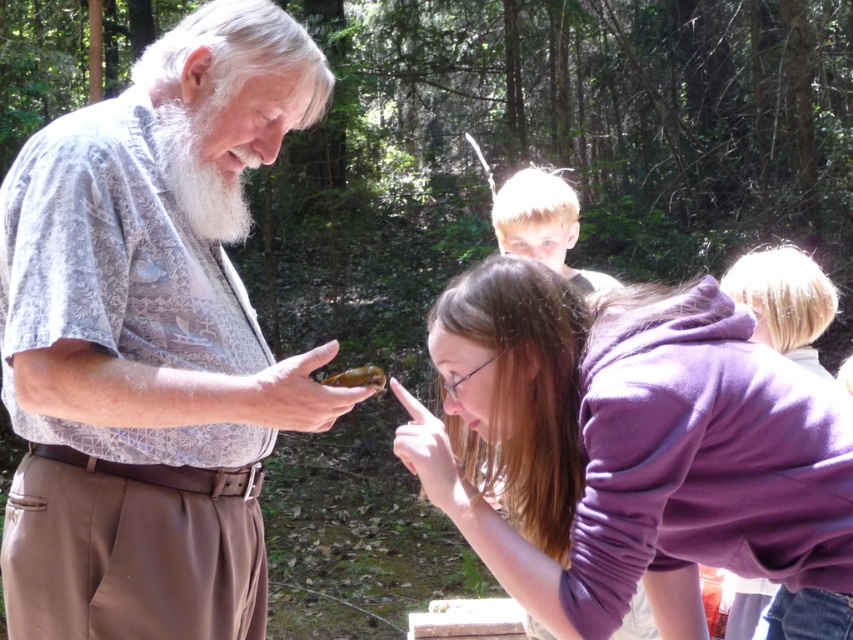
Can you confirm if white fluffy beard at upper left is positioned below blonde hair at upper center?

Yes.

Can you confirm if white fluffy beard at upper left is wider than blonde hair at upper center?

No, white fluffy beard at upper left is not wider than blonde hair at upper center.

You are a GUI agent. You are given a task and a screenshot of the screen. Output one action in this format:
    pyautogui.click(x=<x>, y=<y>)
    Task: Click on the white fluffy beard at upper left
    This screenshot has width=853, height=640.
    Given the screenshot: What is the action you would take?
    pyautogui.click(x=198, y=173)

Identify the location of white fluffy beard at upper left. (198, 173).

Is purple fleece jacket at lower center thinner than white fluffy beard at upper left?

Incorrect, purple fleece jacket at lower center's width is not less than white fluffy beard at upper left's.

Is purple fleece jacket at lower center below white fluffy beard at upper left?

Yes.

Who is more forward, (732, 483) or (164, 132)?

Positioned in front is point (732, 483).

Identify the location of purple fleece jacket at lower center. (631, 451).

Does matte gray shirt at center have a greater width compared to purple fleece jacket at lower center?

No, matte gray shirt at center is not wider than purple fleece jacket at lower center.

Find the location of a particular element. Image resolution: width=853 pixels, height=640 pixels. matte gray shirt at center is located at coordinates (151, 340).